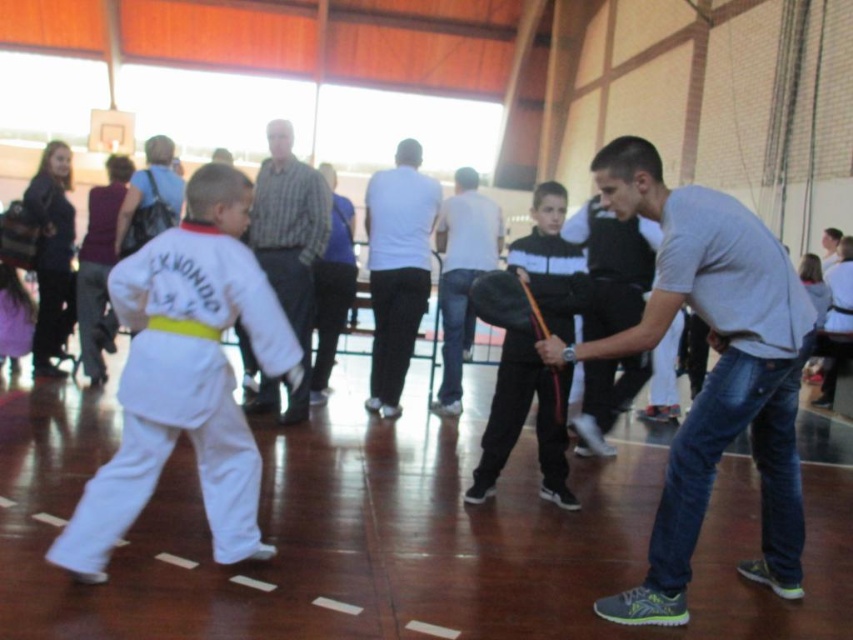
You are a photographer positioned at the back of the gymnasium. You need to take a photo that clearly shows both the black matte jacket at center and the striped cotton shirt at center. Based on their positions, which one will appear larger in the photo?

The black matte jacket at center will appear larger in the photo because it is closer to the viewer than the striped cotton shirt at center.

You are a visitor standing in the gymnasium and see the black matte jacket at center. If you want to take a closer look at the jacket, how many steps do you need to take forward if each step covers 2.5 feet?

The black matte jacket at center is 12.57 feet away. Since each step covers 2.5 feet, dividing 12.57 by 2.5 gives approximately 5.028 steps. Therefore, you would need to take 6 steps forward to reach the jacket.

You are observing a martial arts class from the sidelines. You notice two participants wearing a striped cotton shirt at center and a light gray shirt at center. Based on their positions, which one is standing closer to the ceiling?

The striped cotton shirt at center is above the light gray shirt at center, so the striped cotton shirt at center is closer to the ceiling.